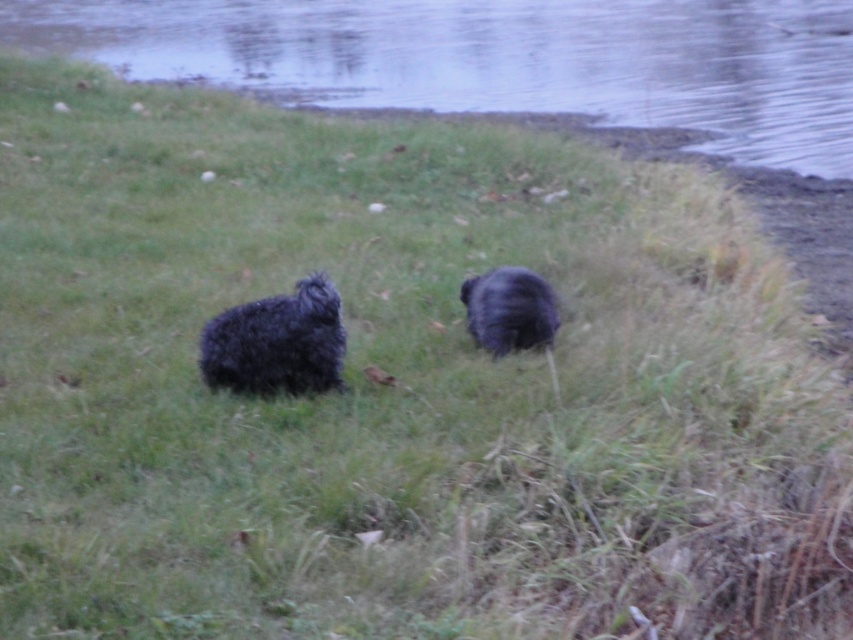
In the scene shown: You are a photographer trying to capture the smooth water at center and the fuzzy black dog at left in a single frame. Based on their sizes, which one would appear bigger in your photo?

The smooth water at center would appear bigger in the photo since it is larger in size than the fuzzy black dog at left.

You are a photographer trying to capture the smooth water at center and the fuzzy black dog at left in the same frame. Based on their positions, which object should you adjust your camera to focus on first to ensure both are in the shot?

Since the smooth water at center is to the right of the fuzzy black dog at left, you should focus on the fuzzy black dog at left first to ensure both are within the frame as you adjust the camera angle to include the smooth water at center to the right of the dog.